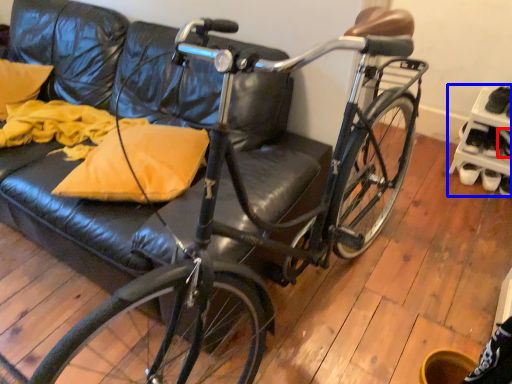
Question: Which object appears closest to the camera in this image, shoe (highlighted by a red box) or shelf (highlighted by a blue box)?

Choices:
 (A) shoe
 (B) shelf

Answer: (B)